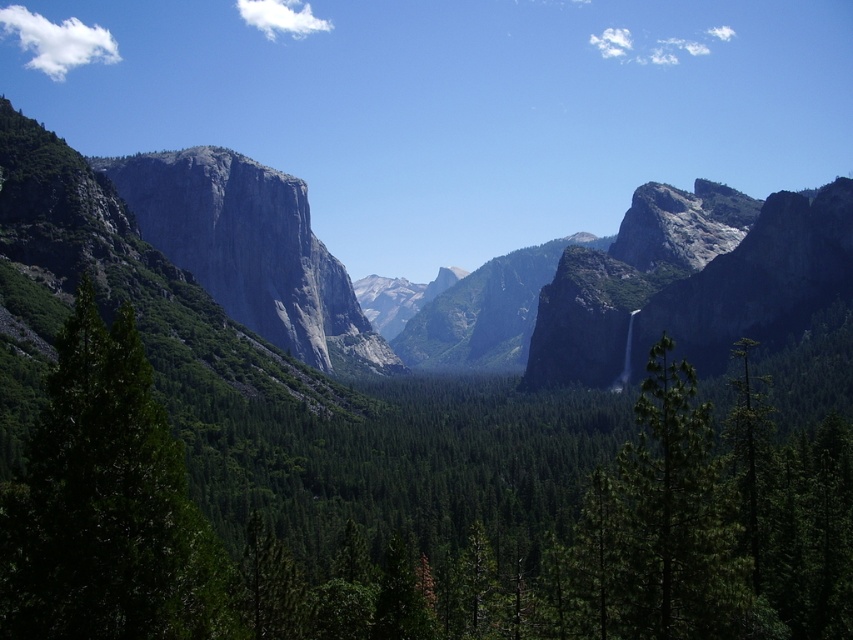
Is green matte tree at center thinner than green matte tree at left?

No.

Is green matte tree at center to the left of green matte tree at left from the viewer's perspective?

Incorrect, green matte tree at center is not on the left side of green matte tree at left.

You are a GUI agent. You are given a task and a screenshot of the screen. Output one action in this format:
    pyautogui.click(x=<x>, y=<y>)
    Task: Click on the green matte tree at center
    This screenshot has height=640, width=853.
    Given the screenshot: What is the action you would take?
    pyautogui.click(x=404, y=540)

Identify the location of green matte tree at center. This screenshot has height=640, width=853. (404, 540).